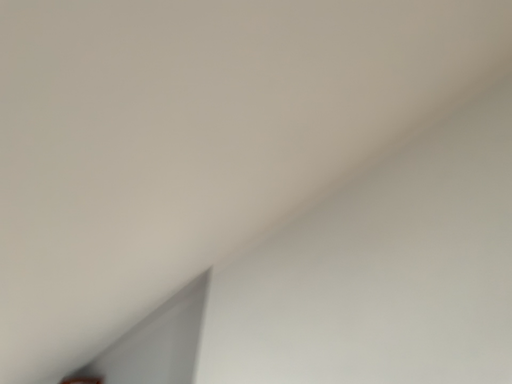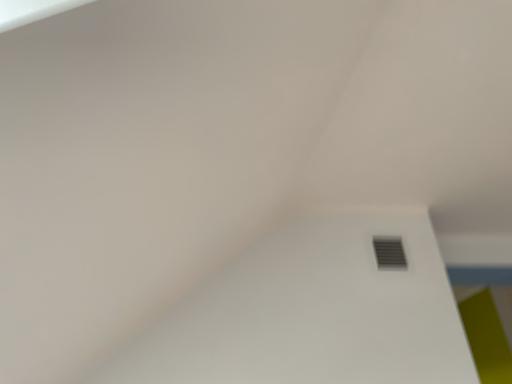
Question: How did the camera likely rotate when shooting the video?

Choices:
 (A) rotated downward
 (B) rotated upward

Answer: (B)